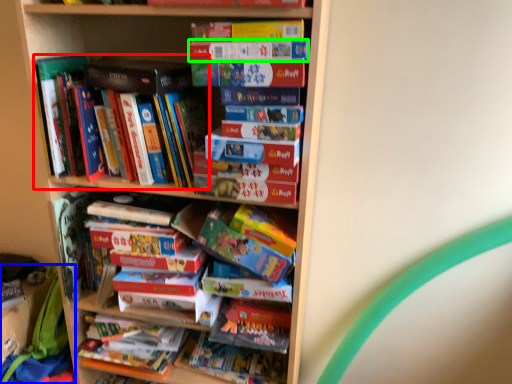
Question: Based on their relative distances, which object is nearer to book (highlighted by a red box)? Choose from backpack (highlighted by a blue box) and paperback book (highlighted by a green box).

Choices:
 (A) backpack
 (B) paperback book

Answer: (B)